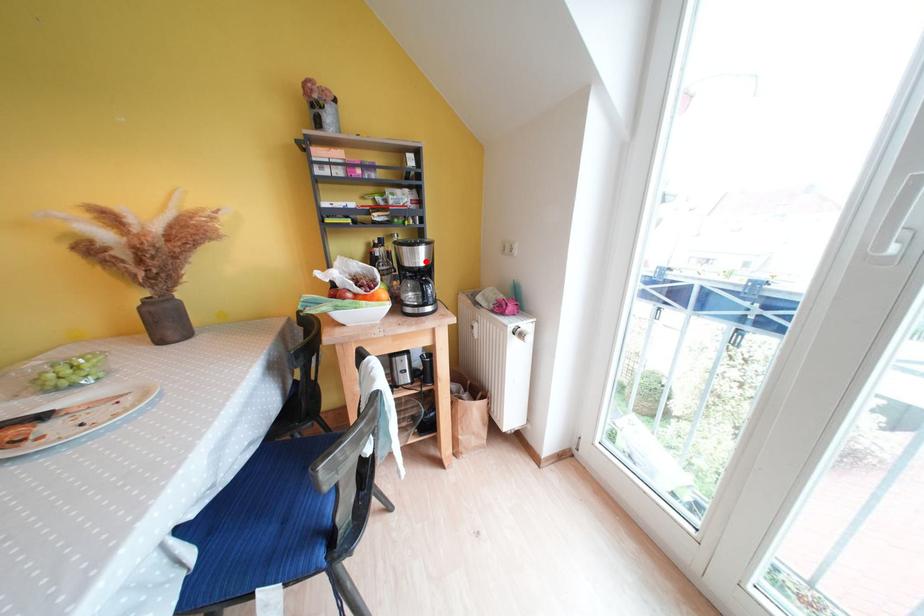
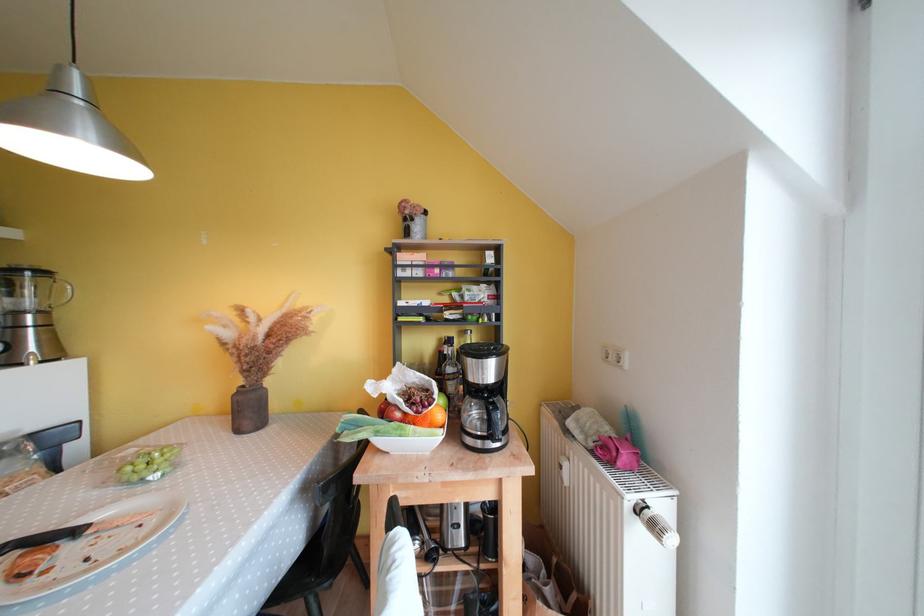
Question: I am providing you with two images of the same scene from different viewpoints. A red point is shown in image1. For the corresponding object point in image2, is it positioned nearer or farther from the camera?

Choices:
 (A) Nearer
 (B) Farther

Answer: (B)